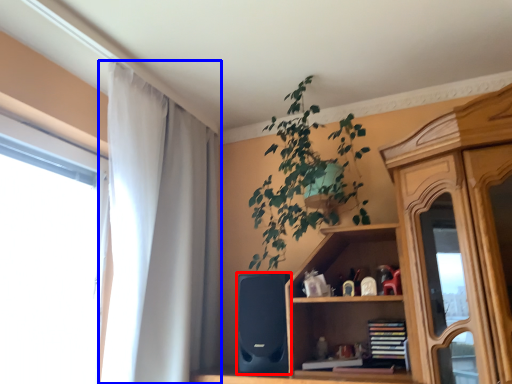
Question: Which object is closer to the camera taking this photo, speaker (highlighted by a red box) or curtain (highlighted by a blue box)?

Choices:
 (A) speaker
 (B) curtain

Answer: (B)